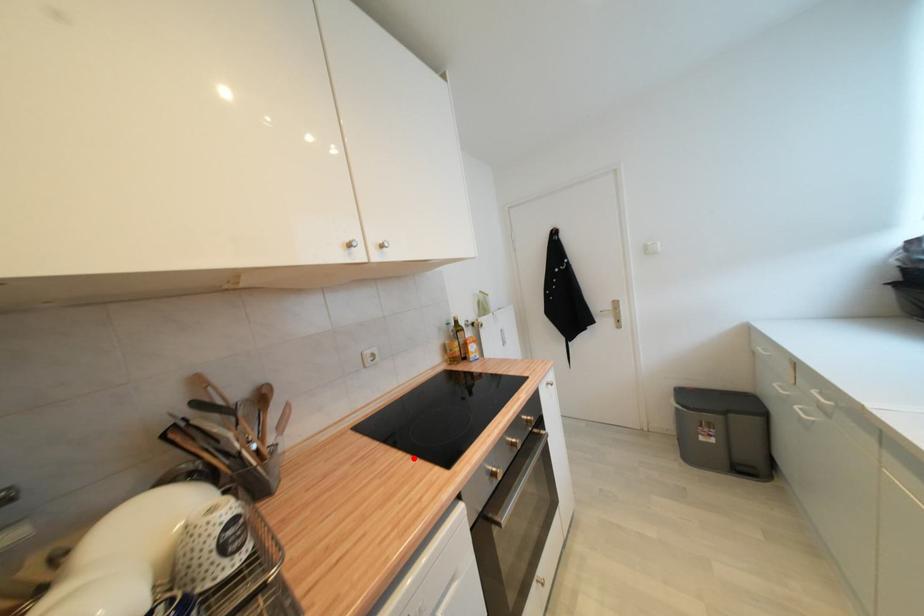
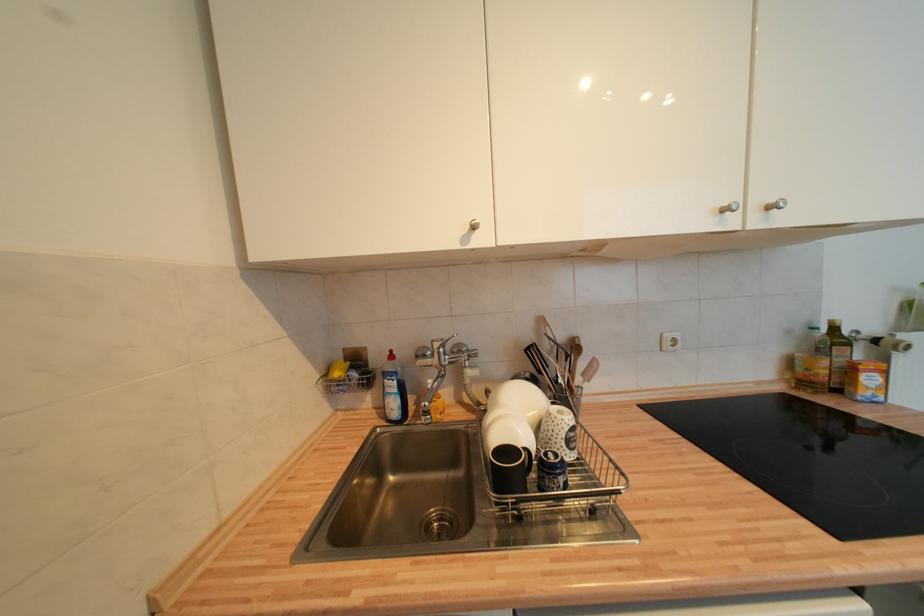
Locate, in the second image, the point that corresponds to the highlighted location in the first image.

(742, 477)